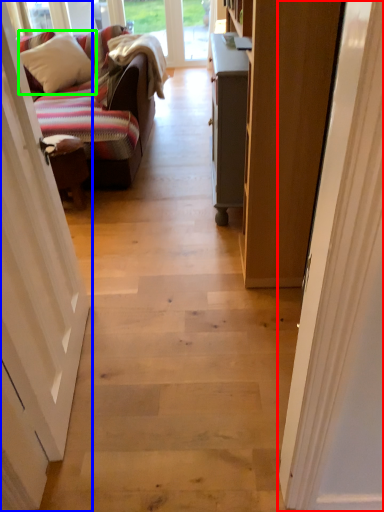
Question: Which is farther away from door (highlighted by a red box)? door (highlighted by a blue box) or pillow (highlighted by a green box)?

Choices:
 (A) door
 (B) pillow

Answer: (B)